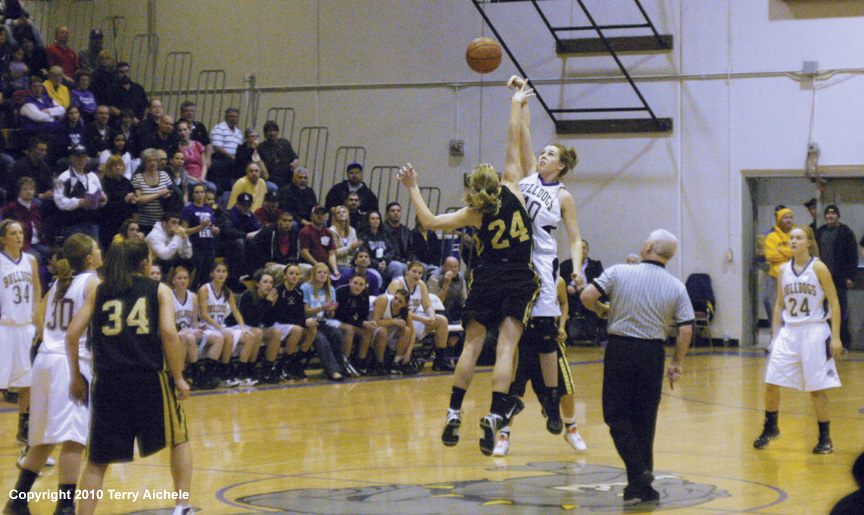
You are a GUI agent. You are given a task and a screenshot of the screen. Output one action in this format:
    pyautogui.click(x=<x>, y=<y>)
    Task: Click on the wall
    The image size is (864, 515).
    Given the screenshot: What is the action you would take?
    pyautogui.click(x=752, y=110), pyautogui.click(x=357, y=34)